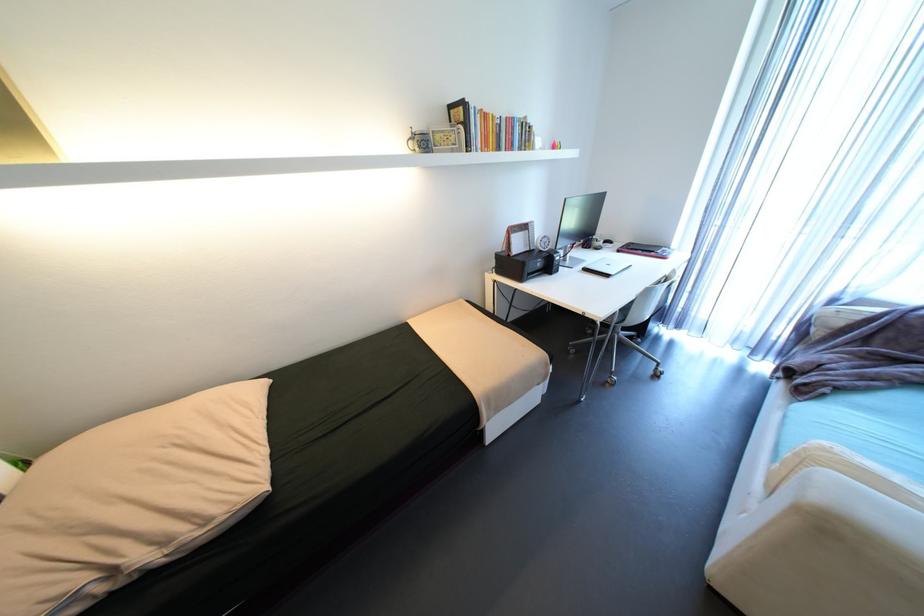
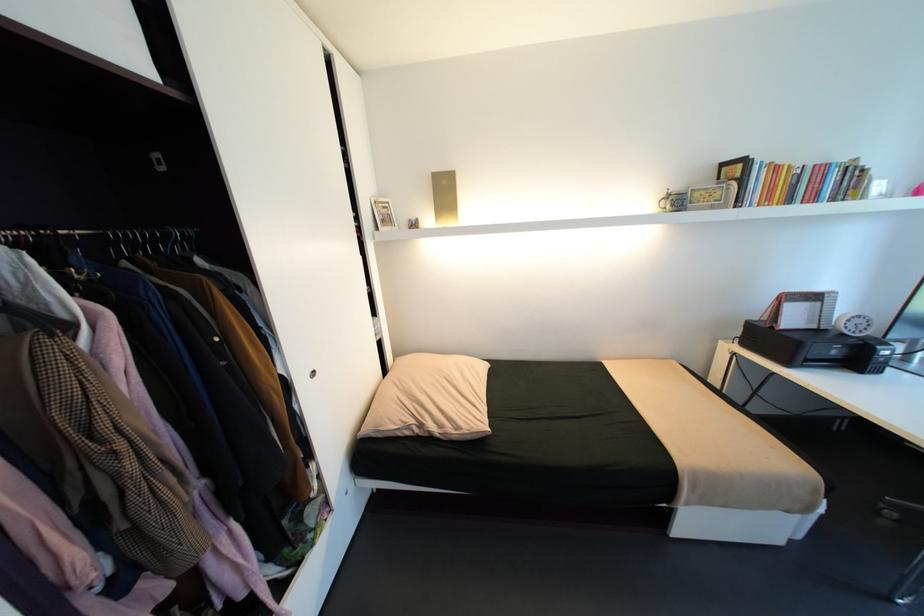
Where in the second image is the point corresponding to point (516, 254) from the first image?

(779, 328)